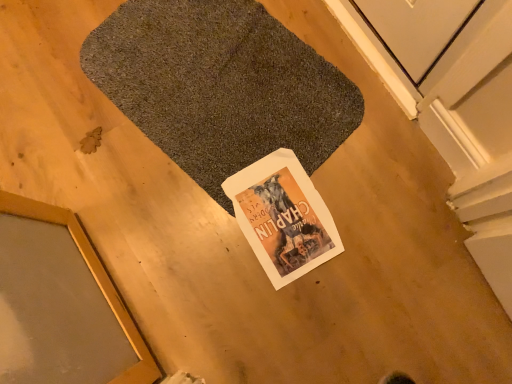
Question: Are gold-framed mirror at lower left and dark gray carpet at center far apart?

Choices:
 (A) no
 (B) yes

Answer: (A)

Question: Considering the relative sizes of gold-framed mirror at lower left and dark gray carpet at center in the image provided, is gold-framed mirror at lower left wider than dark gray carpet at center?

Choices:
 (A) no
 (B) yes

Answer: (A)

Question: Could you tell me if gold-framed mirror at lower left is turned towards dark gray carpet at center?

Choices:
 (A) no
 (B) yes

Answer: (B)

Question: Considering the relative positions of gold-framed mirror at lower left and dark gray carpet at center in the image provided, is gold-framed mirror at lower left behind dark gray carpet at center?

Choices:
 (A) yes
 (B) no

Answer: (B)

Question: From the image's perspective, does gold-framed mirror at lower left appear higher than dark gray carpet at center?

Choices:
 (A) yes
 (B) no

Answer: (B)

Question: Looking at the image, does dark gray carpet at center seem bigger or smaller compared to white paper magazine at center?

Choices:
 (A) small
 (B) big

Answer: (B)

Question: Is dark gray carpet at center spatially inside white paper magazine at center, or outside of it?

Choices:
 (A) inside
 (B) outside

Answer: (B)

Question: Considering the positions of point (106, 71) and point (246, 211), is point (106, 71) closer or farther from the camera than point (246, 211)?

Choices:
 (A) closer
 (B) farther

Answer: (B)

Question: Considering their positions, is dark gray carpet at center located in front of or behind white paper magazine at center?

Choices:
 (A) behind
 (B) front

Answer: (B)

Question: Is white paper magazine at center inside or outside of dark gray carpet at center?

Choices:
 (A) inside
 (B) outside

Answer: (A)

Question: From a real-world perspective, is white paper magazine at center positioned above or below dark gray carpet at center?

Choices:
 (A) below
 (B) above

Answer: (A)

Question: From the image's perspective, relative to dark gray carpet at center, is white paper magazine at center above or below?

Choices:
 (A) above
 (B) below

Answer: (B)

Question: Visually, is white paper magazine at center positioned to the left or to the right of dark gray carpet at center?

Choices:
 (A) left
 (B) right

Answer: (B)

Question: Considering the relative positions of gold-framed mirror at lower left and white paper magazine at center in the image provided, is gold-framed mirror at lower left to the left or to the right of white paper magazine at center?

Choices:
 (A) right
 (B) left

Answer: (B)

Question: Is point [x=130, y=317] closer or farther from the camera than point [x=311, y=246]?

Choices:
 (A) closer
 (B) farther

Answer: (A)